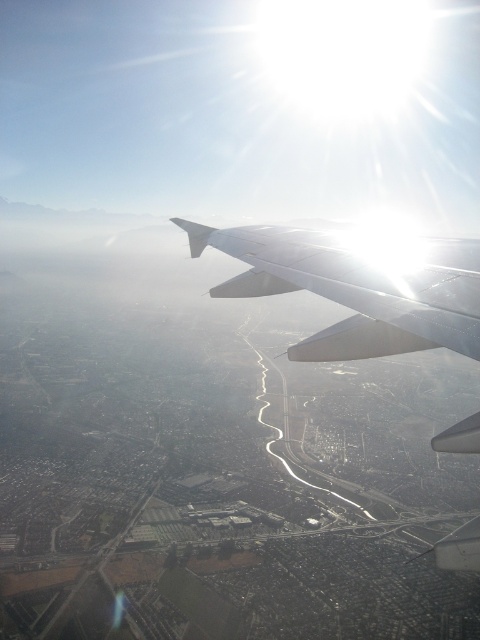
You are a flight attendant observing the airplane window and notice the white matte wing at upper center and the white glossy wing at upper center. Which of these two wings has a greater width?

The white matte wing at upper center has a greater width than the white glossy wing at upper center.

You are a passenger on an airplane and notice a point marked at coordinates (348, 292) on your window. What object is located at this point?

The point at coordinates (348, 292) marks the white matte wing at upper center.

You are a passenger sitting by the window and notice two white wings near the top of your view. Which one is positioned higher between the white matte wing at upper center and the white glossy wing at upper center?

The white glossy wing at upper center is positioned higher because the white matte wing at upper center is located below it.